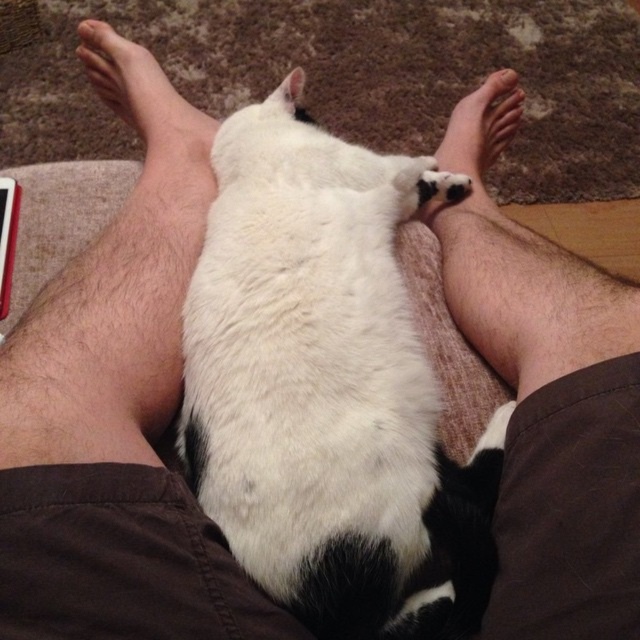
Question: From the image, what is the correct spatial relationship of white soft fur cat at center in relation to skinny barefoot at upper left?

Choices:
 (A) above
 (B) below

Answer: (B)

Question: Which is nearer to the white soft skin at center?

Choices:
 (A) skinny barefoot at upper left
 (B) white soft fur cat at center

Answer: (B)

Question: Can you confirm if white soft skin at center is bigger than skinny barefoot at upper left?

Choices:
 (A) no
 (B) yes

Answer: (B)

Question: Which point is farther from the camera taking this photo?

Choices:
 (A) (156, 81)
 (B) (477, 205)
 (C) (198, 387)

Answer: (A)

Question: Is white soft fur cat at center behind white soft skin at center?

Choices:
 (A) no
 (B) yes

Answer: (A)

Question: Estimate the real-world distances between objects in this image. Which object is farther from the white soft skin at center?

Choices:
 (A) skinny barefoot at upper left
 (B) white soft fur cat at center

Answer: (A)